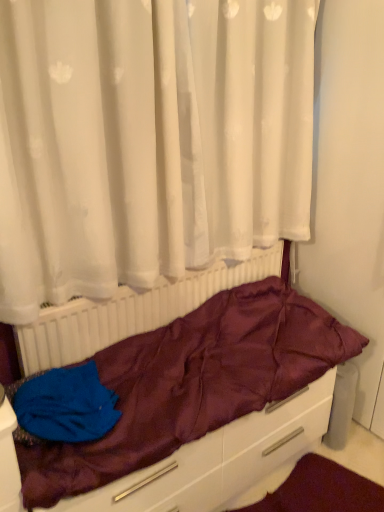
Question: Based on their positions, is white plastic radiator at center located to the left or right of white sheer curtain at upper center?

Choices:
 (A) left
 (B) right

Answer: (B)

Question: Choose the correct answer: Is white plastic radiator at center inside white sheer curtain at upper center or outside it?

Choices:
 (A) inside
 (B) outside

Answer: (B)

Question: Which object is positioned farthest from the white sheer curtain at upper center?

Choices:
 (A) maroon satin sleeping bag at center
 (B) blue fabric at lower left
 (C) white plastic radiator at center

Answer: (B)

Question: Which object is positioned farthest from the white sheer curtain at upper center?

Choices:
 (A) blue fabric at lower left
 (B) white plastic radiator at center
 (C) maroon satin sleeping bag at center

Answer: (A)